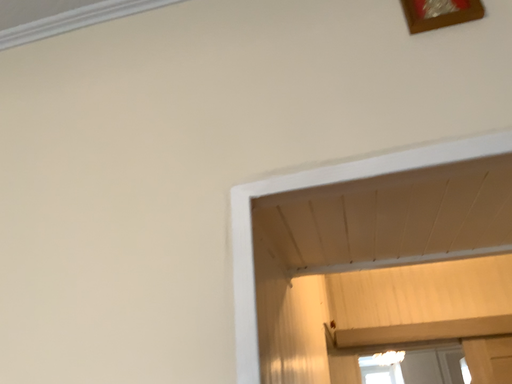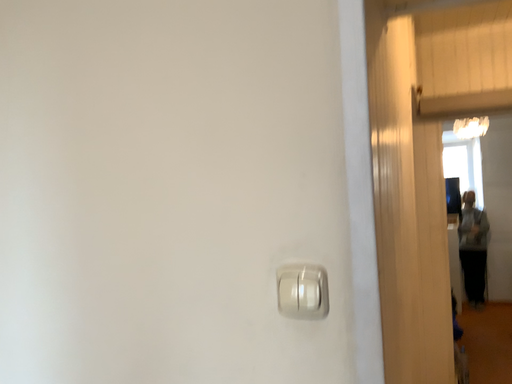
Question: How did the camera likely rotate when shooting the video?

Choices:
 (A) rotated downward
 (B) rotated upward

Answer: (A)